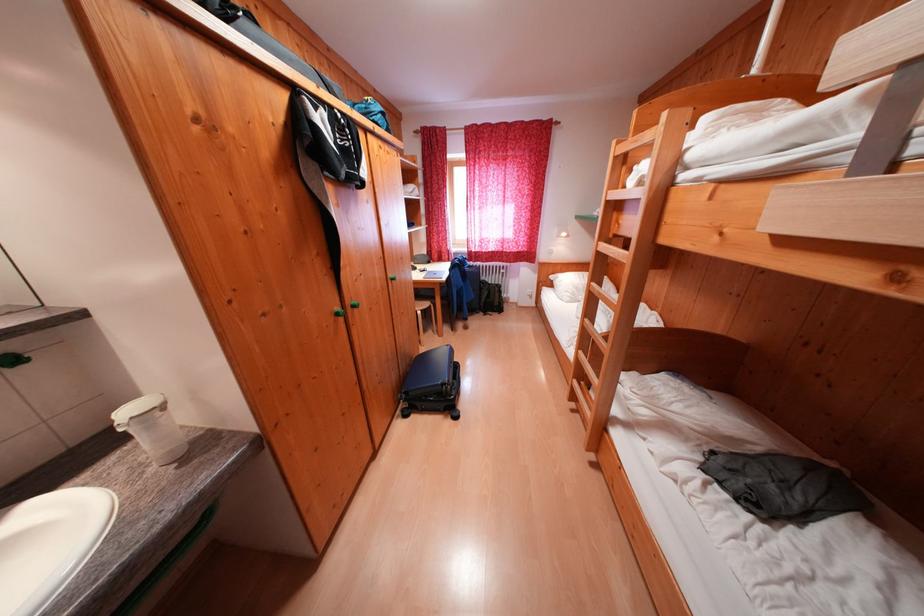
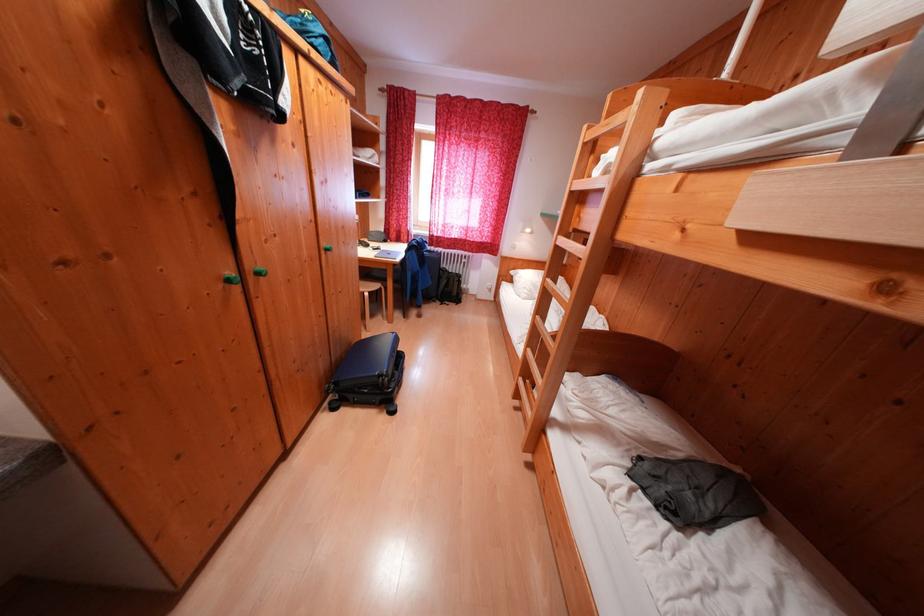
The point at (456, 384) is marked in the first image. Where is the corresponding point in the second image?

(395, 376)